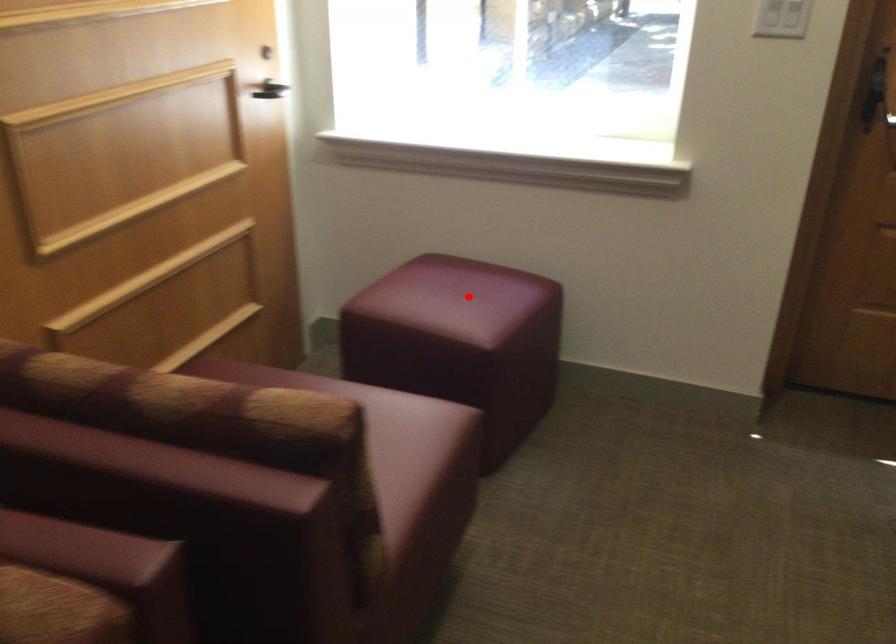
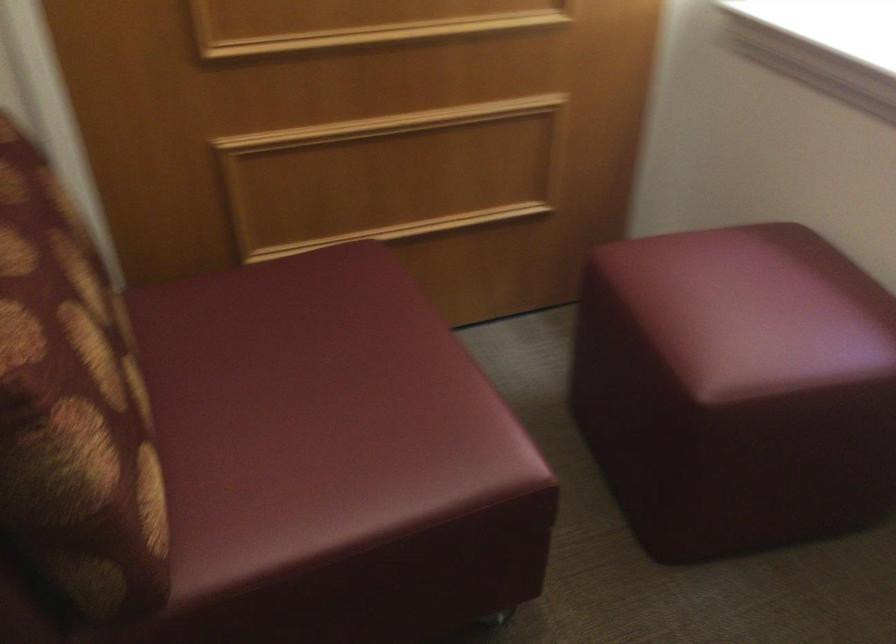
Question: A red point is marked in image1. In image2, is the corresponding 3D point closer to the camera or farther? Reply with the corresponding letter.

Choices:
 (A) The corresponding 3D point is closer.
 (B) The corresponding 3D point is farther.

Answer: (A)